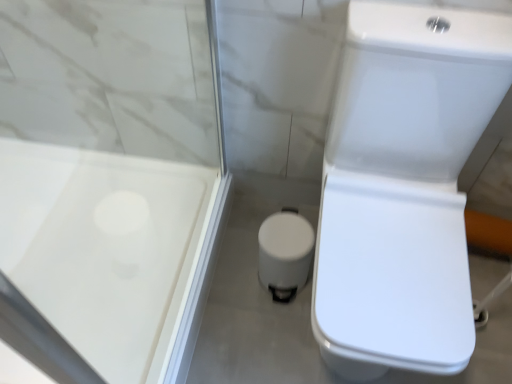
Question: Is transparent plastic screen door at upper left located outside white glossy trash can at center?

Choices:
 (A) no
 (B) yes

Answer: (B)

Question: Considering the relative sizes of transparent plastic screen door at upper left and white glossy trash can at center in the image provided, is transparent plastic screen door at upper left taller than white glossy trash can at center?

Choices:
 (A) yes
 (B) no

Answer: (A)

Question: Does transparent plastic screen door at upper left appear on the right side of white glossy trash can at center?

Choices:
 (A) no
 (B) yes

Answer: (A)

Question: Does transparent plastic screen door at upper left have a lesser width compared to white glossy trash can at center?

Choices:
 (A) yes
 (B) no

Answer: (B)

Question: Is transparent plastic screen door at upper left closer to the viewer compared to white glossy trash can at center?

Choices:
 (A) yes
 (B) no

Answer: (A)

Question: Based on their positions, is white glossy toilet at right located to the left or right of transparent plastic screen door at upper left?

Choices:
 (A) right
 (B) left

Answer: (A)

Question: Is point (331, 124) positioned closer to the camera than point (115, 117)?

Choices:
 (A) closer
 (B) farther

Answer: (A)

Question: From a real-world perspective, is white glossy toilet at right physically located above or below transparent plastic screen door at upper left?

Choices:
 (A) above
 (B) below

Answer: (B)

Question: From their relative heights in the image, would you say white glossy toilet at right is taller or shorter than transparent plastic screen door at upper left?

Choices:
 (A) tall
 (B) short

Answer: (B)

Question: Is transparent plastic screen door at upper left to the left or to the right of white glossy toilet at right in the image?

Choices:
 (A) left
 (B) right

Answer: (A)

Question: From their relative heights in the image, would you say transparent plastic screen door at upper left is taller or shorter than white glossy toilet at right?

Choices:
 (A) tall
 (B) short

Answer: (A)

Question: In terms of width, does transparent plastic screen door at upper left look wider or thinner when compared to white glossy toilet at right?

Choices:
 (A) wide
 (B) thin

Answer: (A)

Question: Does point (168, 33) appear closer or farther from the camera than point (433, 185)?

Choices:
 (A) farther
 (B) closer

Answer: (A)

Question: Would you say white glossy trash can at center is inside or outside white glossy toilet at right?

Choices:
 (A) inside
 (B) outside

Answer: (B)

Question: Visually, is white glossy trash can at center positioned to the left or to the right of white glossy toilet at right?

Choices:
 (A) left
 (B) right

Answer: (A)